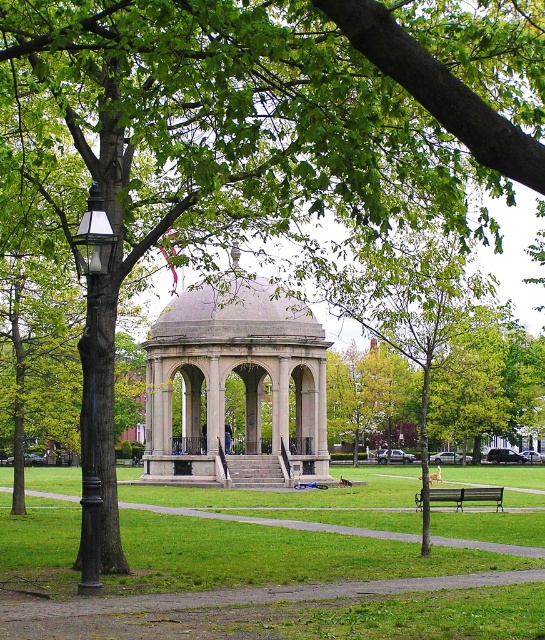
Question: Does green grass at center have a lesser width compared to gray stone gazebo at center?

Choices:
 (A) yes
 (B) no

Answer: (B)

Question: Which object is closer to the camera taking this photo?

Choices:
 (A) green grass at center
 (B) gray stone gazebo at center
 (C) green wooden bench at lower right
 (D) black glass lamp post at left

Answer: (A)

Question: Which point appears farthest from the camera in this image?

Choices:
 (A) (496, 486)
 (B) (82, 580)

Answer: (A)

Question: Among these points, which one is farthest from the camera?

Choices:
 (A) (11, 579)
 (B) (461, 509)

Answer: (B)

Question: Can you confirm if green grass at center is positioned above gray stone gazebo at center?

Choices:
 (A) yes
 (B) no

Answer: (B)

Question: Is green grass at center to the left of black glass lamp post at left from the viewer's perspective?

Choices:
 (A) no
 (B) yes

Answer: (A)